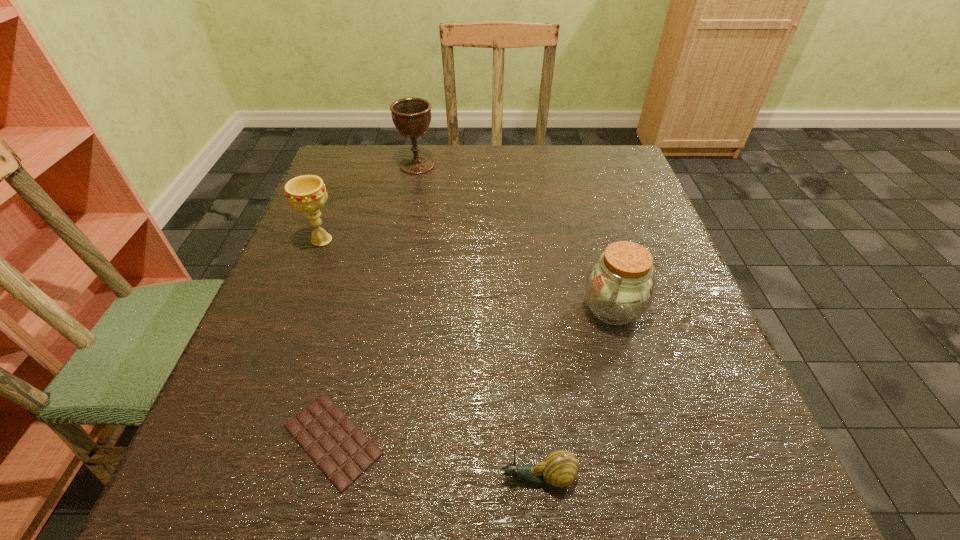
I want to click on the farthest object, so click(x=411, y=116).

Where is `the farther chalice`? The height and width of the screenshot is (540, 960). the farther chalice is located at coordinates (411, 116).

The width and height of the screenshot is (960, 540). I want to click on the left chalice, so click(307, 193).

Where is `the second farthest object`? This screenshot has height=540, width=960. the second farthest object is located at coordinates (307, 193).

What are the coordinates of `the third nearest object` in the screenshot? It's located at (619, 287).

Find the location of a particular element. The width and height of the screenshot is (960, 540). jar is located at coordinates (619, 287).

This screenshot has height=540, width=960. I want to click on the second shortest object, so click(559, 469).

Image resolution: width=960 pixels, height=540 pixels. In order to click on the second object from right to left in this screenshot , I will do `click(559, 469)`.

The image size is (960, 540). Find the location of `the shortest object`. the shortest object is located at coordinates (340, 449).

You are a GUI agent. You are given a task and a screenshot of the screen. Output one action in this format:
    pyautogui.click(x=<x>, y=<y>)
    Task: Click on the vacant space positioned 0.180m on the right of the farther chalice
    The image size is (960, 540).
    Given the screenshot: What is the action you would take?
    pyautogui.click(x=503, y=165)